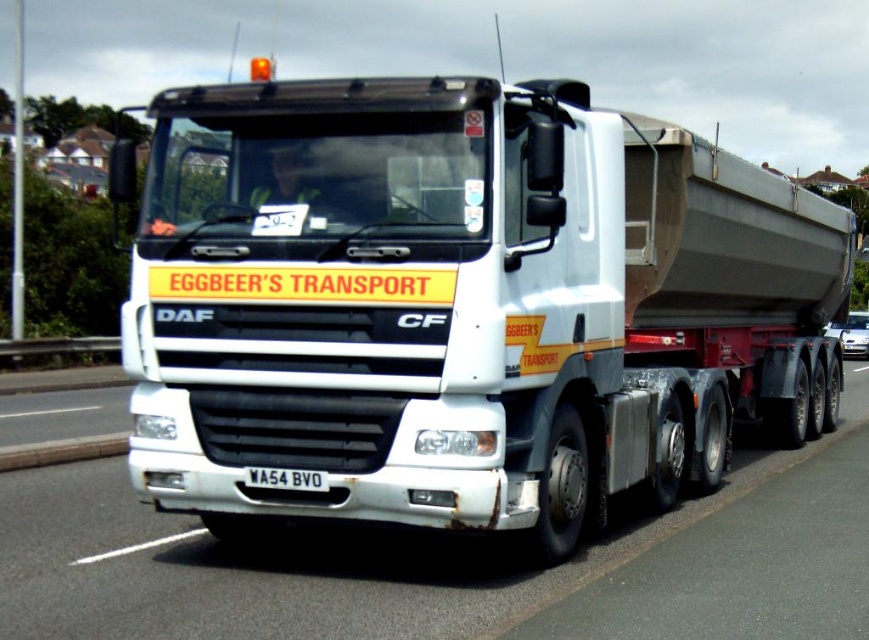
Question: Based on their relative distances, which object is farther from the black plastic license plate at center?

Choices:
 (A) white glossy truck at center
 (B) white matte truck at center

Answer: (B)

Question: Is white matte truck at center positioned at the back of white glossy truck at center?

Choices:
 (A) yes
 (B) no

Answer: (A)

Question: Which point is farther to the camera?

Choices:
 (A) white matte truck at center
 (B) white glossy truck at center

Answer: (A)

Question: Which of the following is the closest to the observer?

Choices:
 (A) white glossy truck at center
 (B) white matte truck at center

Answer: (A)

Question: Does white glossy truck at center appear on the left side of black plastic license plate at center?

Choices:
 (A) yes
 (B) no

Answer: (B)

Question: Is white matte truck at center to the right of white glossy truck at center from the viewer's perspective?

Choices:
 (A) yes
 (B) no

Answer: (B)